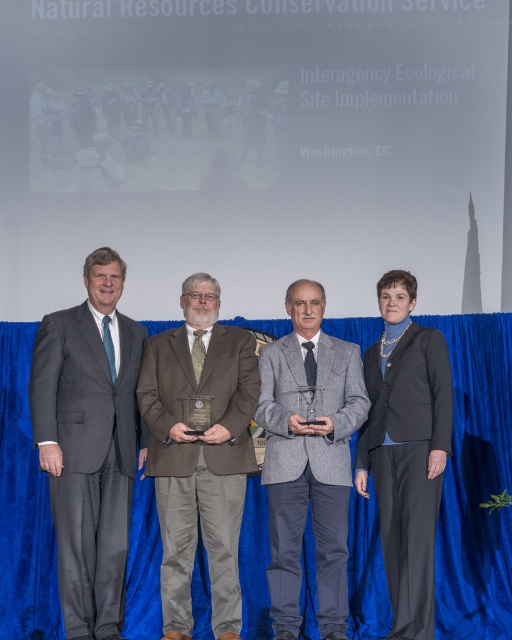
Question: Which object appears farthest from the camera in this image?

Choices:
 (A) brown woolen suit at center
 (B) black wool suit at right
 (C) matte gray suit at left

Answer: (B)

Question: Can you confirm if brown woolen suit at center is thinner than gray wool suit at center?

Choices:
 (A) no
 (B) yes

Answer: (A)

Question: Does gray wool suit at center have a smaller size compared to black wool suit at right?

Choices:
 (A) yes
 (B) no

Answer: (A)

Question: Is brown woolen suit at center bigger than gray wool suit at center?

Choices:
 (A) yes
 (B) no

Answer: (A)

Question: Which of the following is the farthest from the observer?

Choices:
 (A) brown woolen suit at center
 (B) gray wool suit at center

Answer: (B)

Question: Which of the following is the closest to the observer?

Choices:
 (A) black wool suit at right
 (B) matte gray suit at left
 (C) gray wool suit at center
 (D) brown woolen suit at center

Answer: (B)